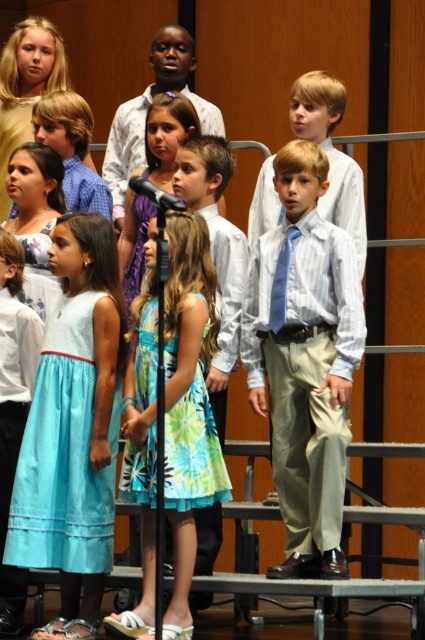
You are standing at the center of the stage and see the point marked at coordinates (305, 358). What object is located at that position?

The point at coordinates (305, 358) corresponds to the light blue striped shirt at center.

You are sitting in the front row of the auditorium and notice a light blue striped shirt at center. Where exactly is this shirt positioned in relation to the stage?

The light blue striped shirt at center is located at point 0.562 along the horizontal axis and 0.718 along the vertical axis relative to the stage.